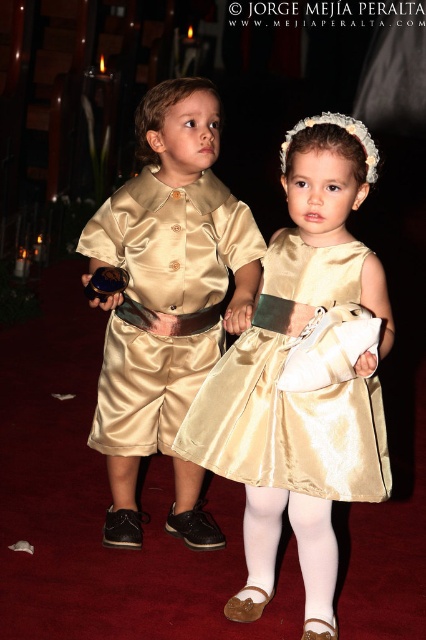
You are a photographer standing 5 feet away from the camera. You want to take a picture of the gold satin dress at center. Can you reach the camera in time if you need to move 2 feet forward?

The gold satin dress at center and camera are 7.04 feet apart. If you are 5 feet away from the camera, moving 2 feet forward would bring you to 3 feet from the camera, which is still within reach to take the picture.

Based on the photo, you are a photographer standing 2 meters away from the two children in the image. You want to take a photo that includes both the gold satin outfit at center and the gold satin dress at center without moving the children. Do you need to adjust your camera lens to a wider angle to capture both of them in the frame?

The gold satin outfit at center is 16.85 inches away from the gold satin dress at center. Since you are 2 meters away from them, the distance between the two children is relatively small compared to your distance from them. Therefore, you might not need to adjust your camera lens to a wider angle to capture both in the frame.

You are a photographer setting up for a photo shoot. You need to ensure that the gold satin dress at center and the white satin tights at lower center are both visible in the frame. Given that the camera has a fixed width, which object should you position closer to the camera to ensure both fit in the frame?

The gold satin dress at center has a larger width than the white satin tights at lower center. To ensure both fit in the frame, you should position the gold satin dress at center closer to the camera since wider objects appear larger and require more space in the frame.